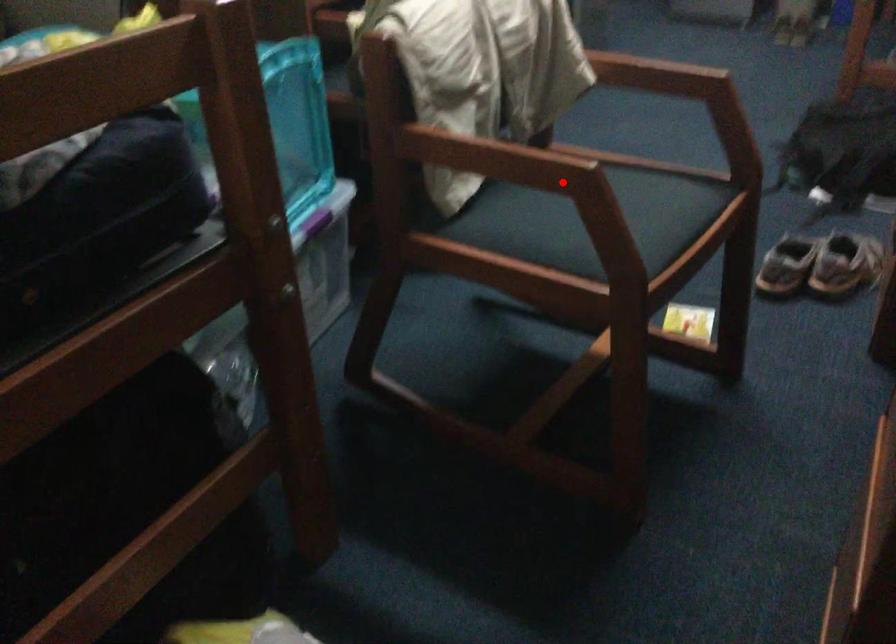
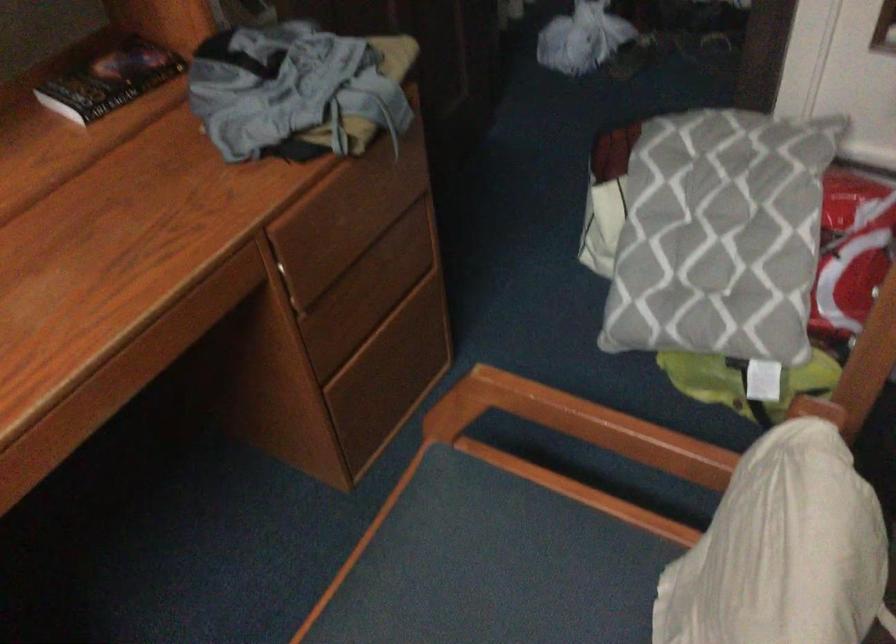
Locate, in the second image, the point that corresponds to the highlighted location in the first image.

(579, 424)